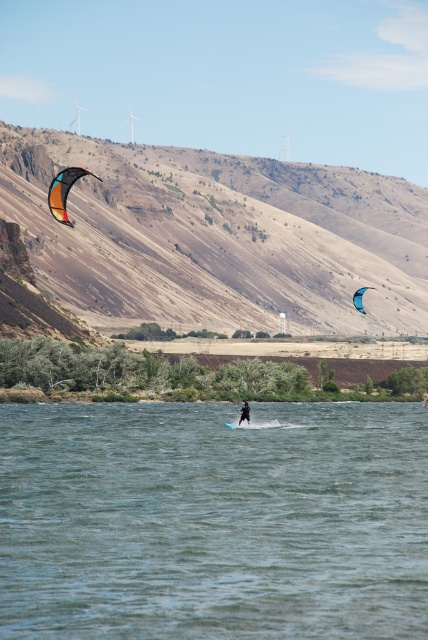
Question: Where is multicolored fabric kite at left located in relation to black matte wetsuit at center in the image?

Choices:
 (A) below
 (B) above

Answer: (B)

Question: Does brown textured hillside at upper left come behind black matte wetsuit at center?

Choices:
 (A) yes
 (B) no

Answer: (A)

Question: Which point appears farthest from the camera in this image?

Choices:
 (A) click(x=258, y=288)
 (B) click(x=362, y=285)
 (C) click(x=47, y=196)
 (D) click(x=244, y=417)

Answer: (B)

Question: Is translucent blue kite at center in front of black matte wetsuit at center?

Choices:
 (A) yes
 (B) no

Answer: (B)

Question: Which is nearer to the translucent blue kite at center?

Choices:
 (A) multicolored fabric kite at left
 (B) clear water at center
 (C) brown textured hillside at upper left
 (D) black matte wetsuit at center

Answer: (C)

Question: Considering the real-world distances, which object is farthest from the multicolored fabric kite at left?

Choices:
 (A) translucent blue kite at center
 (B) brown textured hillside at upper left

Answer: (A)